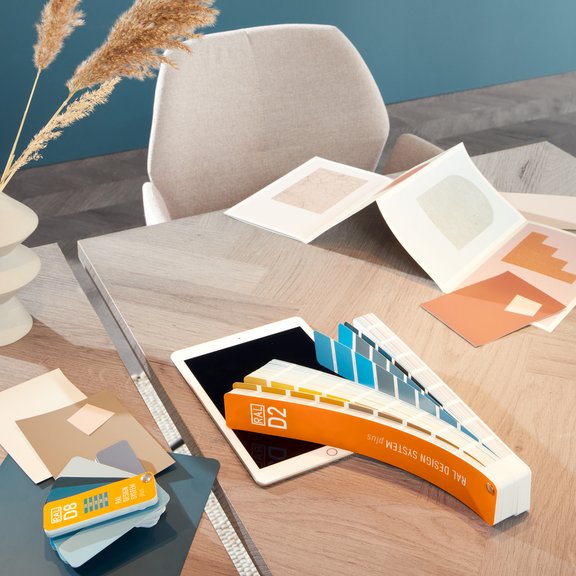
At what (x,y) coordinates should I click in order to perform the action: click on grey/tan table. Please return your answer as a coordinate pair (x, y). Looking at the image, I should click on (518, 162).